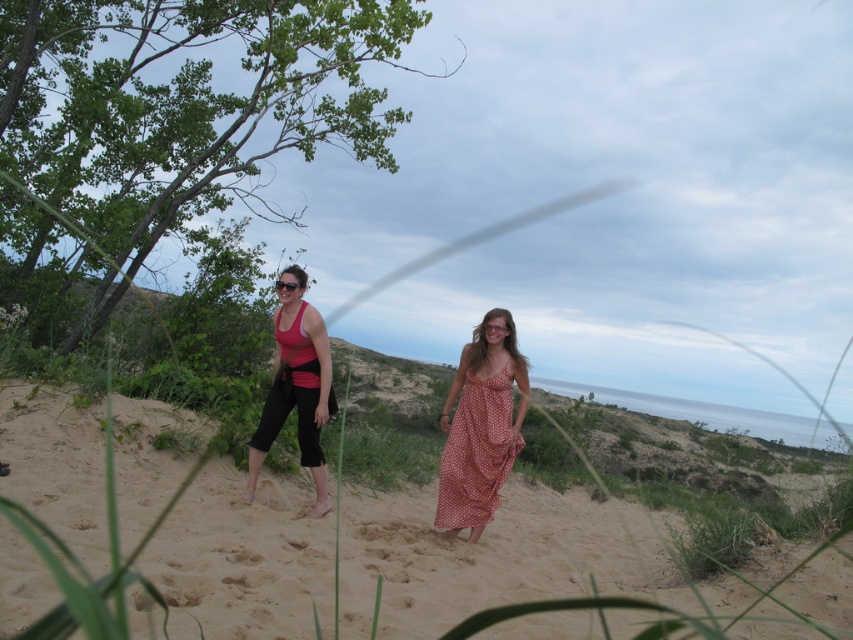
Where is the matte pink tank top at center located in the image?

The matte pink tank top at center is located at point (296, 394).

You are a fashion designer observing two items in the center of a beach scene. The items are the polka dot fabric dress at center and the matte black sunglasses at center. Which item is taller?

The polka dot fabric dress at center is taller than the matte black sunglasses at center.

You are a photographer trying to capture a clear photo of the matte pink tank top at center. Since the polka dot fabric dress at center is blocking your view, can you move to the side to get a better shot?

The matte pink tank top at center is in front of the polka dot fabric dress at center, so moving to the side might not help as the tank top is already blocking the dress. You may need to adjust your angle or move closer to focus on the tank top without obstruction.